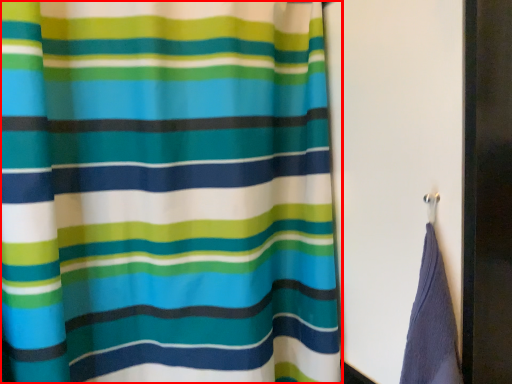
Question: From the image, what is the correct spatial relationship of curtain (annotated by the red box) in relation to screen door?

Choices:
 (A) left
 (B) right

Answer: (A)